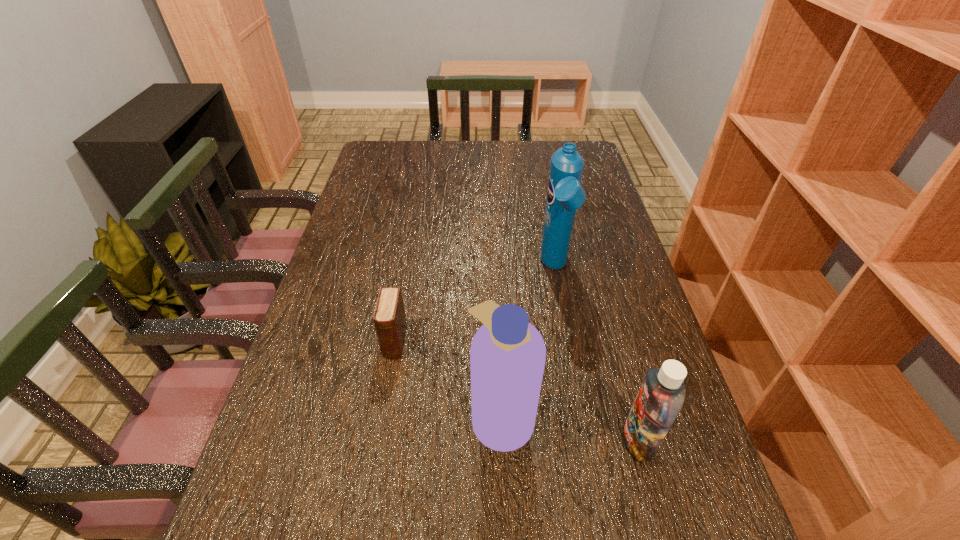
What are the coordinates of `vacant point located 0.190m on the front label of the third tallest object` in the screenshot? It's located at (527, 440).

Identify the location of free space located 0.370m on the front label of the third tallest object. The width and height of the screenshot is (960, 540). (436, 440).

You are a GUI agent. You are given a task and a screenshot of the screen. Output one action in this format:
    pyautogui.click(x=<x>, y=<y>)
    Task: Click on the blank space located on the spine side of the diary
    
    Given the screenshot: What is the action you would take?
    pyautogui.click(x=379, y=431)

The image size is (960, 540). In order to click on object at the right edge in this screenshot , I will do `click(661, 396)`.

This screenshot has height=540, width=960. Find the location of `vacant area at the far edge of the desktop`. vacant area at the far edge of the desktop is located at coordinates (460, 171).

This screenshot has width=960, height=540. What are the coordinates of `free spot at the left edge of the desktop` in the screenshot? It's located at (385, 199).

Identify the location of vacant space at the right edge of the desktop. This screenshot has height=540, width=960. point(598,193).

The width and height of the screenshot is (960, 540). In the image, there is a desktop. What are the coordinates of `vacant space at the far left corner` in the screenshot? It's located at (390, 147).

The width and height of the screenshot is (960, 540). I want to click on free space at the far right corner of the desktop, so click(x=590, y=161).

Locate an element on the screen. The width and height of the screenshot is (960, 540). unoccupied position between the farthest shampoo and the diary is located at coordinates (475, 305).